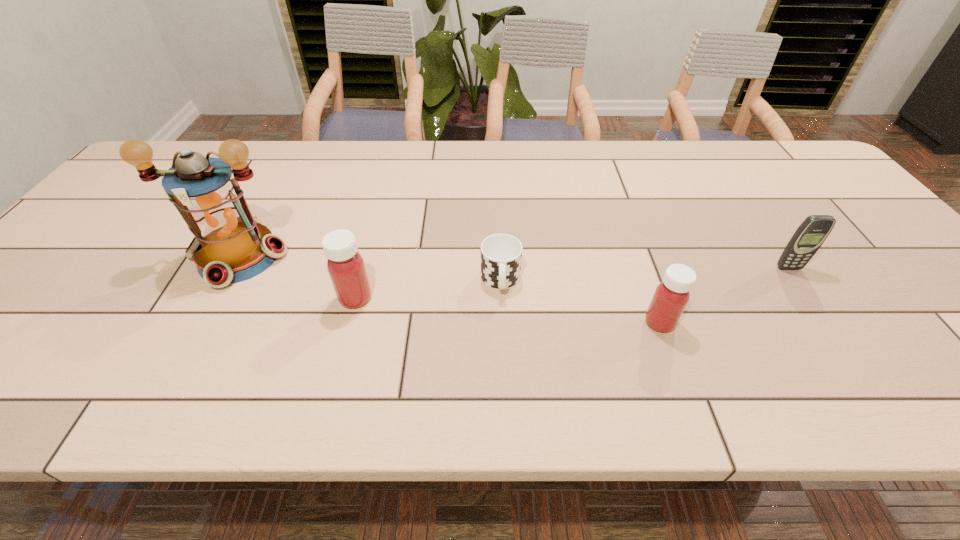
Observe the arrangement of all medicines in the image. To keep them evenly spaced, where would you place another medicine on the left? Please locate a free space. Please provide its 2D coordinates. Your answer should be formatted as a tuple, i.e. [(x, y)], where the tuple contains the x and y coordinates of a point satisfying the conditions above.

[(80, 276)]